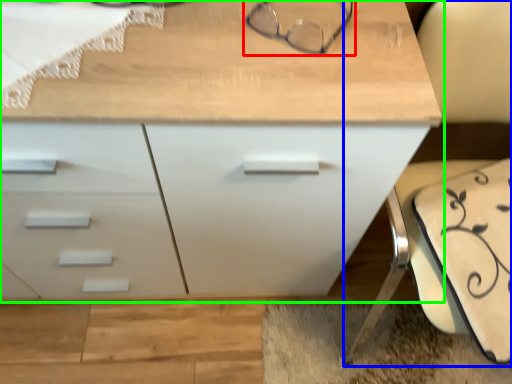
Question: Based on their relative distances, which object is farther from glasses (highlighted by a red box)? Choose from swivel chair (highlighted by a blue box) and chest of drawers (highlighted by a green box).

Choices:
 (A) swivel chair
 (B) chest of drawers

Answer: (A)